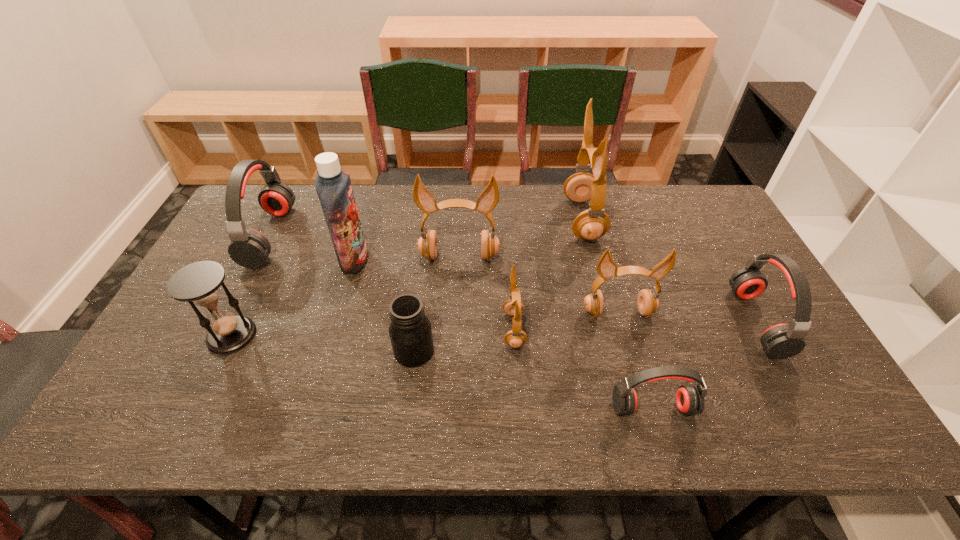
Identify the location of the rightmost object. This screenshot has width=960, height=540. (781, 341).

I want to click on the smallest brown earphone, so click(514, 306).

What are the coordinates of `jar` in the screenshot? It's located at (410, 332).

Identify the location of the shortest earphone. The width and height of the screenshot is (960, 540). (689, 398).

The image size is (960, 540). Identify the location of the nearest object. (689, 398).

The width and height of the screenshot is (960, 540). What are the coordinates of `vacant space located on the front-facing side of the biggest brown earphone` in the screenshot? It's located at (501, 220).

Where is `vacant region located on the front-facing side of the biggest brown earphone`? Image resolution: width=960 pixels, height=540 pixels. vacant region located on the front-facing side of the biggest brown earphone is located at coordinates (447, 220).

Locate an element on the screen. The image size is (960, 540). free space located 0.210m on the front-facing side of the biggest brown earphone is located at coordinates (501, 220).

You are a GUI agent. You are given a task and a screenshot of the screen. Output one action in this format:
    pyautogui.click(x=<x>, y=<y>)
    Task: Click on the blank space located 0.130m on the front label of the blue shampoo
    
    Given the screenshot: What is the action you would take?
    pyautogui.click(x=412, y=260)

This screenshot has height=540, width=960. Identify the location of vacant space situated 0.380m on the front-facing side of the third tallest object. (453, 383).